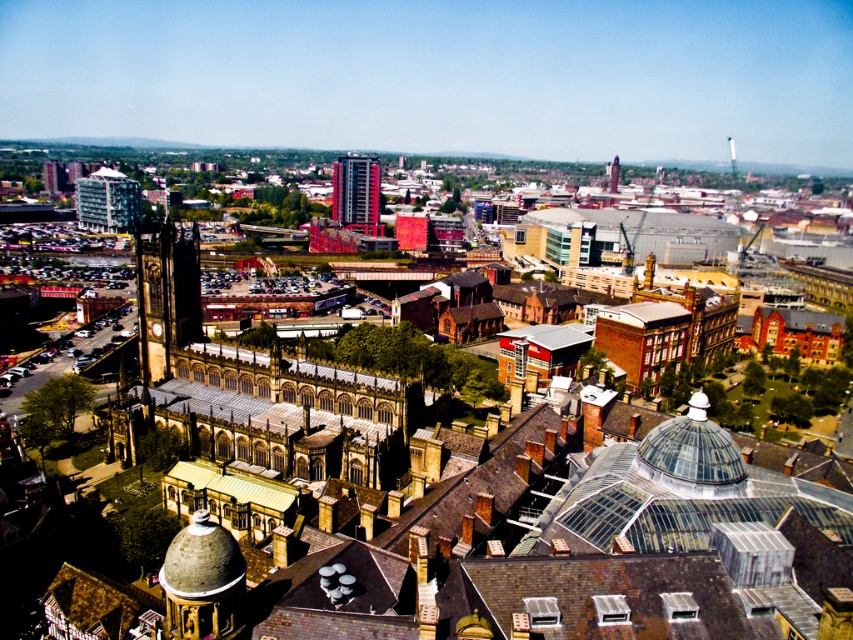
Can you confirm if matte glass building at left is bigger than red glass tower at center?

Actually, matte glass building at left might be smaller than red glass tower at center.

Between matte glass building at left and red glass tower at center, which one is positioned lower?

matte glass building at left is lower down.

The width and height of the screenshot is (853, 640). Identify the location of matte glass building at left. (107, 200).

Who is more distant from viewer, (357, 168) or (611, 186)?

The point (611, 186) is more distant.

Which is in front, point (367, 166) or point (610, 180)?

Point (367, 166) is more forward.

What do you see at coordinates (357, 193) in the screenshot?
I see `red glass tower at center` at bounding box center [357, 193].

You are a GUI agent. You are given a task and a screenshot of the screen. Output one action in this format:
    pyautogui.click(x=<x>, y=<y>)
    Task: Click on the red glass tower at center
    Image resolution: width=853 pixels, height=640 pixels.
    Given the screenshot: What is the action you would take?
    pyautogui.click(x=357, y=193)

You are a GUI agent. You are given a task and a screenshot of the screen. Output one action in this format:
    pyautogui.click(x=<x>, y=<y>)
    Task: Click on the matte glass building at left
    This screenshot has height=640, width=853.
    Given the screenshot: What is the action you would take?
    coord(107,200)

Measure the distance between point (120, 188) and camera.

They are 406.16 meters apart.

Measure the distance between point (77,188) and camera.

Point (77,188) is 1399.19 feet from camera.

Identify the location of matte glass building at left. (107, 200).